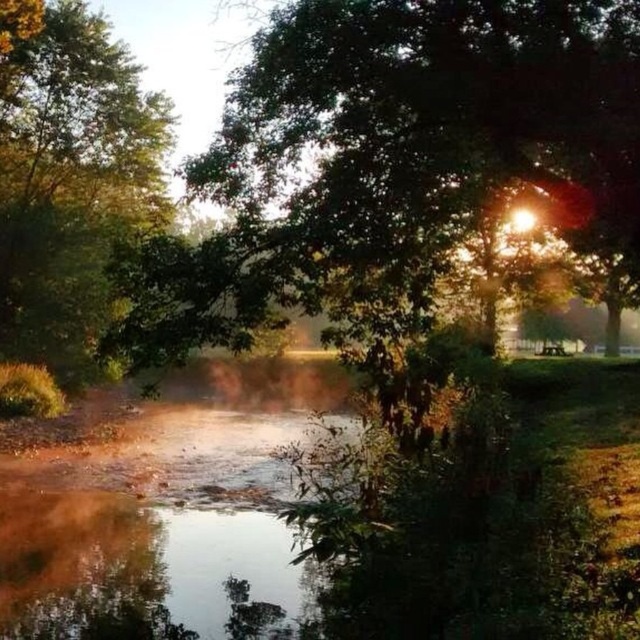
Question: From the image, what is the correct spatial relationship of green leafy tree at center in relation to green leafy tree at left?

Choices:
 (A) right
 (B) left

Answer: (A)

Question: Can you confirm if green leafy tree at center is thinner than green leafy tree at left?

Choices:
 (A) no
 (B) yes

Answer: (A)

Question: Can you confirm if green leafy tree at center is thinner than green leafy tree at left?

Choices:
 (A) no
 (B) yes

Answer: (A)